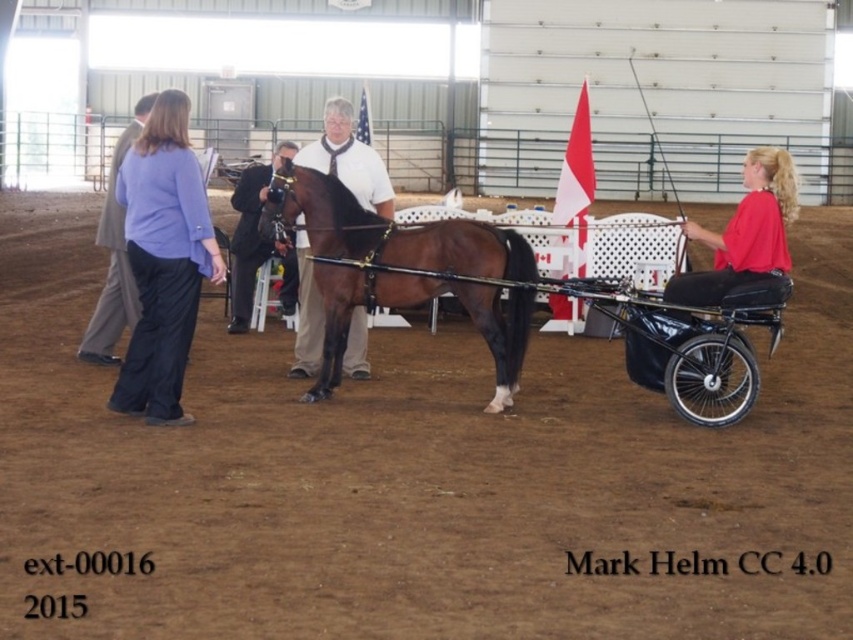
Question: Which is farther from the white glossy shirt at center?

Choices:
 (A) brown glossy horse at center
 (B) dark suit at center

Answer: (B)

Question: Among these points, which one is farthest from the camera?

Choices:
 (A) (312, 186)
 (B) (306, 349)
 (C) (282, 294)

Answer: (C)

Question: Which point is closer to the camera taking this photo?

Choices:
 (A) (387, 243)
 (B) (384, 195)
 (C) (236, 200)

Answer: (A)

Question: Can you confirm if light brown suit at left is thinner than dark suit at center?

Choices:
 (A) yes
 (B) no

Answer: (B)

Question: Does purple fabric pants at left come in front of red matte shirt at right?

Choices:
 (A) yes
 (B) no

Answer: (A)

Question: Is white glossy shirt at center wider than light brown suit at left?

Choices:
 (A) yes
 (B) no

Answer: (A)